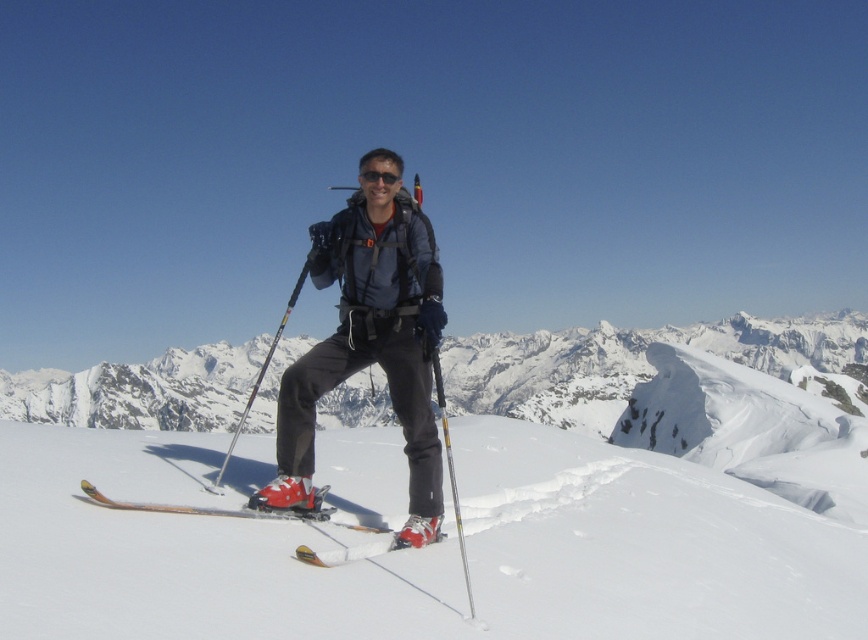
Does snowy white mountain at center have a lesser height compared to matte black ski pole at center?

No, snowy white mountain at center is not shorter than matte black ski pole at center.

Between snowy white mountain at center and matte black ski pole at center, which one is positioned higher?

matte black ski pole at center is higher up.

Who is more forward, (615, 376) or (240, 428)?

Point (615, 376)

The width and height of the screenshot is (868, 640). What are the coordinates of `snowy white mountain at center` in the screenshot? It's located at (630, 358).

Does white snow ski slope at center appear under matte black ski suit at center?

Correct, white snow ski slope at center is located below matte black ski suit at center.

Based on the photo, between white snow ski slope at center and matte black ski suit at center, which one has more height?

matte black ski suit at center

You are a GUI agent. You are given a task and a screenshot of the screen. Output one action in this format:
    pyautogui.click(x=<x>, y=<y>)
    Task: Click on the white snow ski slope at center
    The image size is (868, 640).
    Given the screenshot: What is the action you would take?
    pyautogui.click(x=418, y=548)

Who is positioned more to the right, snowy white mountain at center or transparent plastic goggles at center?

snowy white mountain at center is more to the right.

Is point (18, 396) behind point (378, 173)?

Yes, point (18, 396) is farther from viewer.

Is point (830, 356) in front of point (360, 177)?

No, (830, 356) is further to viewer.

Identify the location of snowy white mountain at center. (630, 358).